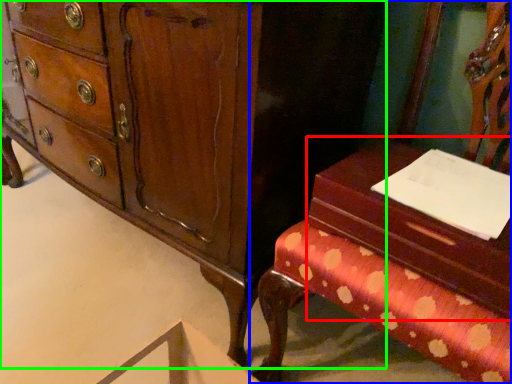
Question: Estimate the real-world distances between objects in this image. Which object is farther from vanity (highlighted by a red box), furniture (highlighted by a blue box) or chest of drawers (highlighted by a green box)?

Choices:
 (A) furniture
 (B) chest of drawers

Answer: (B)